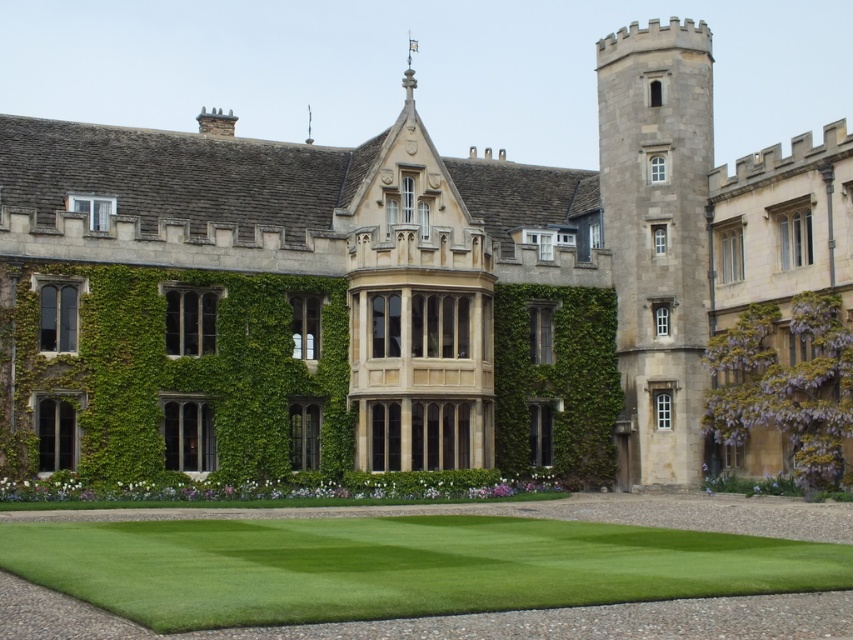
Between green lawn at lower center and stone tower at center right, which one has less height?

green lawn at lower center is shorter.

Which is behind, point (193, 548) or point (685, 474)?

Positioned behind is point (685, 474).

The image size is (853, 640). Find the location of `green lawn at lower center`. green lawn at lower center is located at coordinates (396, 566).

Does stone tower at center right appear on the left side of green ivy wall at center?

No, stone tower at center right is not to the left of green ivy wall at center.

Is point (613, 273) positioned in front of point (613, 419)?

No, (613, 273) is behind (613, 419).

Does point (631, 99) come farther from viewer compared to point (531, 396)?

Yes, point (631, 99) is farther from viewer.

Find the location of `stone tower at center right`. stone tower at center right is located at coordinates (657, 240).

Describe the element at coordinates (555, 381) in the screenshot. The image size is (853, 640). I see `green ivy wall at center` at that location.

Looking at this image, is green ivy wall at center thinner than purple leafy hedge at right?

No.

Who is more forward, (614,474) or (805,449)?

Point (805,449)

Where is `green ivy wall at center`? green ivy wall at center is located at coordinates (555, 381).